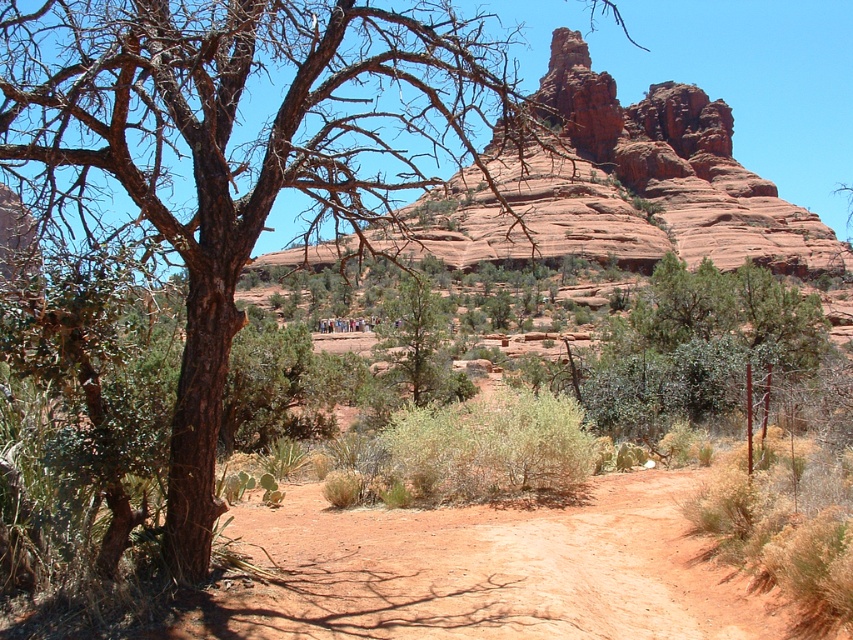
You are standing at the center of the desert scene. Which direction should you walk to reach the brown rough bark tree at left?

The brown rough bark tree at left is located at point (x=242, y=148), which is to the left side of the scene. Therefore, you should walk to the left to reach it.

You are a hiker in the desert and see the brown rough bark tree at left and the green textured tree at center. Which tree is farther to the east?

The green textured tree at center is farther to the east because the brown rough bark tree at left is positioned on the left side of it, meaning the green textured tree at center is to the east of the brown rough bark tree at left.

You are standing at the center of the desert scene. You want to walk towards the brown rough bark tree at left. Which direction should you face to head directly towards it?

To head directly towards the brown rough bark tree at left, you should face towards the left since the tree is located at point 0.233 on the x coordinate, which is to the left of the center point at 0.5.